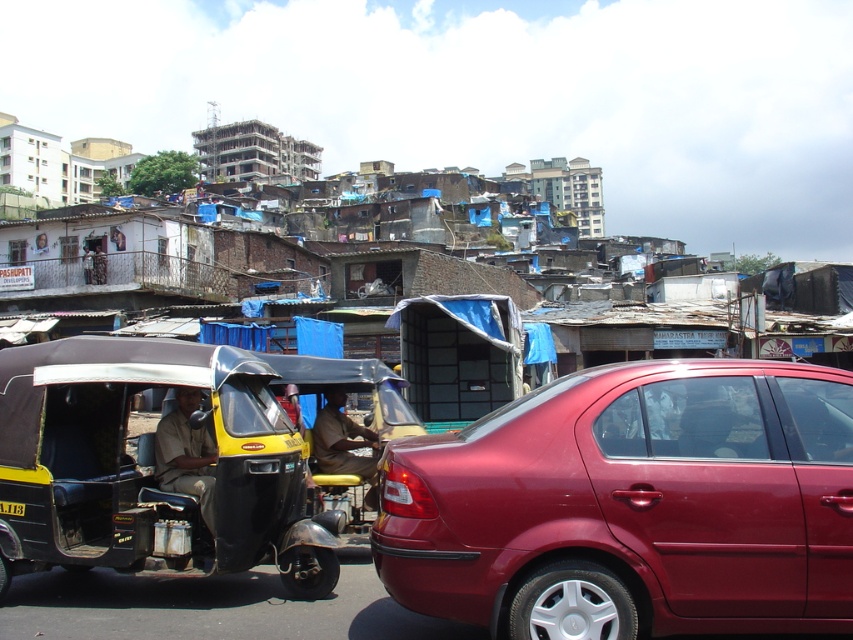
Question: Estimate the real-world distances between objects in this image. Which object is farther from the shiny metallic car at right?

Choices:
 (A) yellow matte tricycle at center
 (B) brown fabric auto-rickshaw driver at center

Answer: (B)

Question: Can you confirm if shiny metallic car at right is wider than light brown fabric auto-rickshaw driver at center-left?

Choices:
 (A) yes
 (B) no

Answer: (A)

Question: Is light brown fabric auto-rickshaw driver at center-left above brown fabric auto-rickshaw driver at center?

Choices:
 (A) no
 (B) yes

Answer: (B)

Question: Based on their relative distances, which object is farther from the light brown fabric auto-rickshaw driver at center-left?

Choices:
 (A) yellow matte tricycle at center
 (B) shiny metallic car at right

Answer: (B)

Question: Does yellow matte tricycle at center appear on the right side of light brown fabric auto-rickshaw driver at center-left?

Choices:
 (A) no
 (B) yes

Answer: (A)

Question: Estimate the real-world distances between objects in this image. Which object is closer to the brown fabric auto-rickshaw driver at center?

Choices:
 (A) shiny metallic car at right
 (B) yellow matte tricycle at center
 (C) light brown fabric auto-rickshaw driver at center-left

Answer: (C)